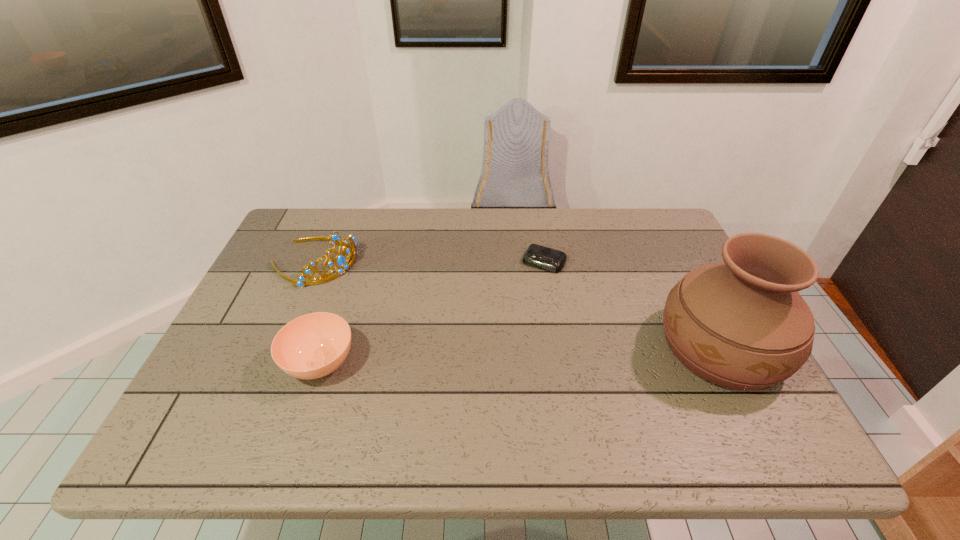
I want to click on free space that is in between the second tallest object and the rightmost object, so click(517, 305).

Where is `blank region between the alarm clock and the third tallest object`? The image size is (960, 540). blank region between the alarm clock and the third tallest object is located at coordinates (432, 313).

Identify the location of free space between the alarm clock and the tiara. (429, 262).

Where is `empty space that is in between the tiara and the tallest object`? The height and width of the screenshot is (540, 960). empty space that is in between the tiara and the tallest object is located at coordinates (517, 305).

The image size is (960, 540). What are the coordinates of `vacant space that is in between the rightmost object and the shortest object` in the screenshot? It's located at (633, 305).

Locate an element on the screen. This screenshot has height=540, width=960. free space between the third shortest object and the alarm clock is located at coordinates (429, 262).

Locate an element on the screen. This screenshot has height=540, width=960. empty space that is in between the tiara and the tallest object is located at coordinates point(517,305).

Find the location of `free space between the third shortest object and the urn`. free space between the third shortest object and the urn is located at coordinates (517, 305).

Locate an element on the screen. vacant space that's between the third tallest object and the rightmost object is located at coordinates (520, 355).

At what (x,y) coordinates should I click in order to perform the action: click on the closest object to the third shortest object. Please return your answer as a coordinate pair (x, y). The height and width of the screenshot is (540, 960). Looking at the image, I should click on (312, 346).